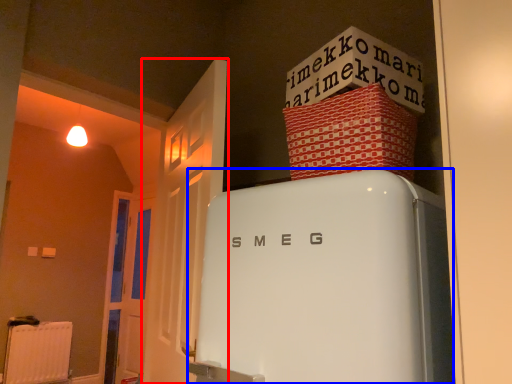
Question: Among these objects, which one is nearest to the camera, door (highlighted by a red box) or refrigerator (highlighted by a blue box)?

Choices:
 (A) door
 (B) refrigerator

Answer: (B)